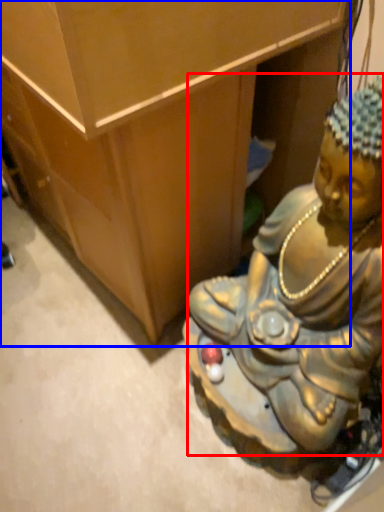
Question: Which object appears farthest to the camera in this image, person (highlighted by a red box) or furniture (highlighted by a blue box)?

Choices:
 (A) person
 (B) furniture

Answer: (B)